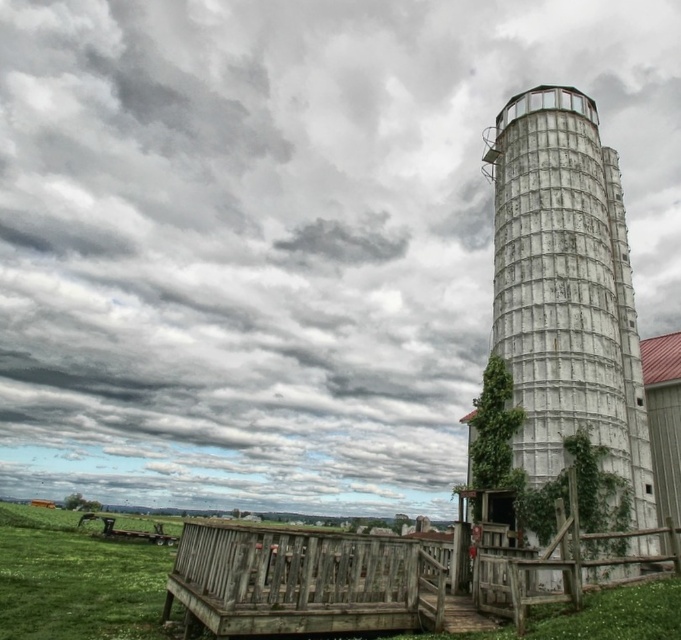
Question: Which of the following is the farthest from the observer?

Choices:
 (A) (501, 259)
 (B) (269, 627)

Answer: (A)

Question: Is white weathered metal silo at right below weathered wood fence at lower center?

Choices:
 (A) no
 (B) yes

Answer: (A)

Question: Can you confirm if white weathered metal silo at right is positioned to the right of weathered wood fence at lower center?

Choices:
 (A) no
 (B) yes

Answer: (B)

Question: Among these points, which one is farthest from the camera?

Choices:
 (A) (276, 586)
 (B) (592, 396)

Answer: (B)

Question: Which point appears farthest from the camera in this image?

Choices:
 (A) (259, 596)
 (B) (543, 163)

Answer: (B)

Question: Does white weathered metal silo at right have a lesser width compared to weathered wood fence at lower center?

Choices:
 (A) yes
 (B) no

Answer: (A)